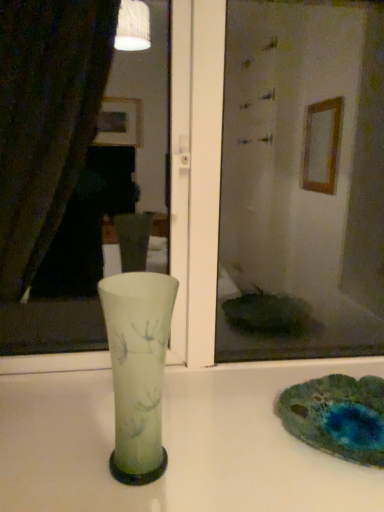
At what (x,y) coordinates should I click in order to perform the action: click on free space to the back side of frosted glass vase at center. Please return your answer as a coordinate pair (x, y). The image size is (384, 512). Looking at the image, I should click on (161, 414).